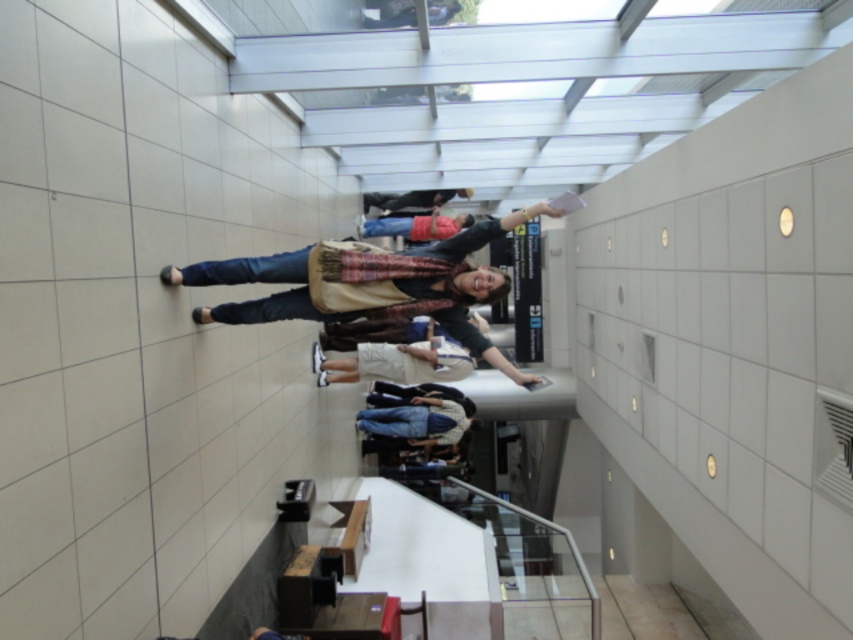
Question: Is denim jeans at center thinner than matte black backpack at center?

Choices:
 (A) no
 (B) yes

Answer: (A)

Question: Does denim jeans at center appear on the right side of matte black backpack at center?

Choices:
 (A) no
 (B) yes

Answer: (A)

Question: Among these points, which one is farthest from the camera?

Choices:
 (A) (416, 228)
 (B) (444, 202)

Answer: (B)

Question: Can you confirm if denim jeans at center is wider than matte black backpack at center?

Choices:
 (A) yes
 (B) no

Answer: (A)

Question: Which point appears farthest from the camera in this image?

Choices:
 (A) (392, 236)
 (B) (436, 204)

Answer: (B)